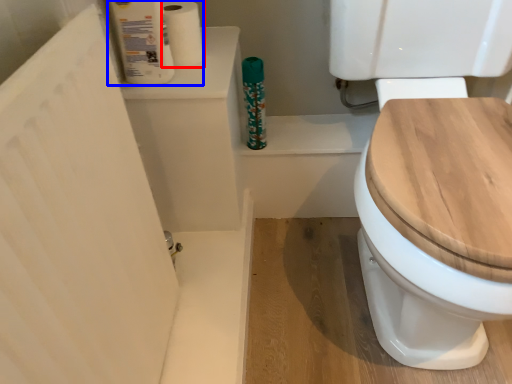
Question: Among these objects, which one is farthest to the camera, toilet paper (highlighted by a red box) or toilet paper (highlighted by a blue box)?

Choices:
 (A) toilet paper
 (B) toilet paper

Answer: (A)